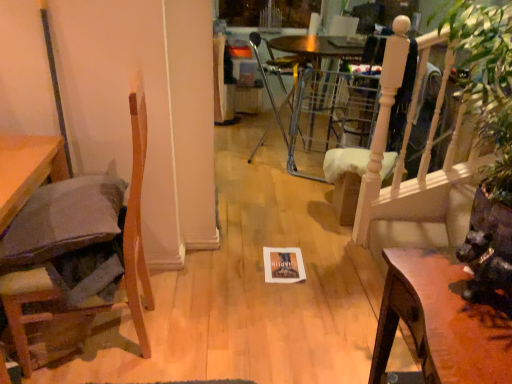
Question: In terms of height, does metallic silver chair at center, which is the first chair in right-to-left order, look taller or shorter compared to wooden chair at left, the 2th chair in the top-to-bottom sequence?

Choices:
 (A) tall
 (B) short

Answer: (B)

Question: Considering the relative positions of metallic silver chair at center, which appears as the first chair when viewed from the back, and wooden chair at left, which is counted as the 2th chair, starting from the right, in the image provided, is metallic silver chair at center, which appears as the first chair when viewed from the back, to the left or to the right of wooden chair at left, which is counted as the 2th chair, starting from the right,?

Choices:
 (A) left
 (B) right

Answer: (B)

Question: Considering the real-world distances, which object is closest to the gray fabric pillow at left?

Choices:
 (A) wooden chair at left, the 2th chair in the top-to-bottom sequence
 (B) metallic silver chair at center, positioned as the first chair in top-to-bottom order
 (C) wooden table at lower right

Answer: (A)

Question: Considering the real-world distances, which object is farthest from the wooden table at lower right?

Choices:
 (A) wooden chair at left, marked as the 1th chair in a left-to-right arrangement
 (B) gray fabric pillow at left
 (C) metallic silver chair at center, which is counted as the second chair, starting from the bottom

Answer: (C)